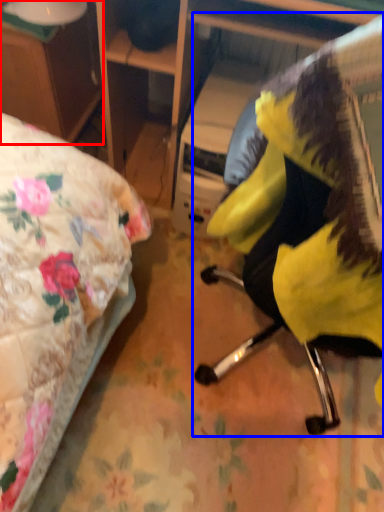
Question: Which of the following is the farthest to the observer, desk (highlighted by a red box) or chair (highlighted by a blue box)?

Choices:
 (A) desk
 (B) chair

Answer: (A)